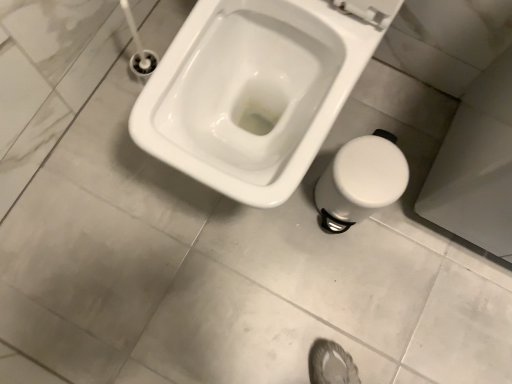
This screenshot has width=512, height=384. In order to click on free point to the right of white glossy toilet at center in this screenshot , I will do pos(407,182).